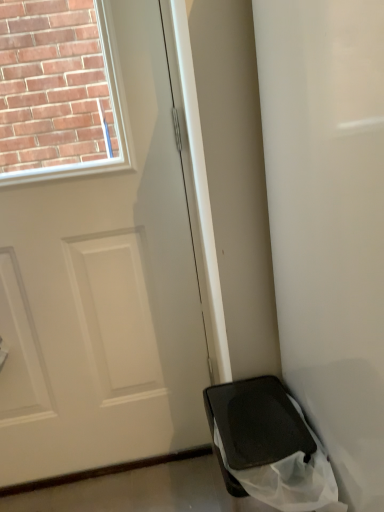
The height and width of the screenshot is (512, 384). Describe the element at coordinates (329, 221) in the screenshot. I see `black matte bag at lower right` at that location.

Where is `white matte door at center`? white matte door at center is located at coordinates (104, 294).

The height and width of the screenshot is (512, 384). What are the coordinates of `black matte bag at lower right` in the screenshot? It's located at (329, 221).

Is black matte bag at lower right positioned far away from white matte door at center?

black matte bag at lower right is near white matte door at center, not far away.

Which of these two, black matte bag at lower right or white matte door at center, stands shorter?

black matte bag at lower right is shorter.

From a real-world perspective, does black matte bag at lower right sit lower than white matte door at center?

Yes, from a real-world perspective, black matte bag at lower right is under white matte door at center.

Which point is more distant from viewer, [337,303] or [0,452]?

The point [0,452] is more distant.

Is black matte trash can at lower right completely or partially outside of black matte bag at lower right?

Yes, black matte trash can at lower right is not within black matte bag at lower right.

Considering the sizes of objects black matte trash can at lower right and black matte bag at lower right in the image provided, who is shorter, black matte trash can at lower right or black matte bag at lower right?

With less height is black matte trash can at lower right.

Which is behind, black matte trash can at lower right or black matte bag at lower right?

black matte trash can at lower right.

Considering the relative sizes of black matte bag at lower right and black matte trash can at lower right in the image provided, is black matte bag at lower right bigger than black matte trash can at lower right?

Correct, black matte bag at lower right is larger in size than black matte trash can at lower right.

Considering the points (301, 115) and (233, 492), which point is behind, point (301, 115) or point (233, 492)?

The point (233, 492) is farther from the camera.

From a real-world perspective, is black matte bag at lower right physically located above or below black matte trash can at lower right?

In terms of real-world spatial position, black matte bag at lower right is above black matte trash can at lower right.

You are a GUI agent. You are given a task and a screenshot of the screen. Output one action in this format:
    pyautogui.click(x=<x>, y=<y>)
    Task: Click on the screen door above the black matte trash can at lower right (from the image's perspective)
    
    Given the screenshot: What is the action you would take?
    pyautogui.click(x=329, y=221)

Considering the positions of point (115, 364) and point (311, 441), is point (115, 364) closer or farther from the camera than point (311, 441)?

Point (115, 364) appears to be farther away from the viewer than point (311, 441).

Is white matte door at center inside the boundaries of black matte trash can at lower right, or outside?

The correct answer is: outside.

Is white matte door at center wider or thinner than black matte trash can at lower right?

Considering their sizes, white matte door at center looks slimmer than black matte trash can at lower right.

Does point (15, 321) appear closer or farther from the camera than point (315, 306)?

Point (15, 321) appears to be farther away from the viewer than point (315, 306).

What's the angular difference between white matte door at center and black matte bag at lower right's facing directions?

0.00226 degrees separate the facing orientations of white matte door at center and black matte bag at lower right.

Consider the image. From a real-world perspective, is white matte door at center located higher than black matte bag at lower right?

Yes, from a real-world perspective, white matte door at center is over black matte bag at lower right

Is white matte door at center with black matte bag at lower right?

white matte door at center is not next to black matte bag at lower right, and they're not touching.

From the image's perspective, is black matte trash can at lower right located beneath white matte door at center?

Correct, black matte trash can at lower right appears lower than white matte door at center in the image.

I want to click on door behind the black matte trash can at lower right, so click(104, 294).

From a real-world perspective, is black matte trash can at lower right on top of white matte door at center?

No, from a real-world perspective, black matte trash can at lower right is not over white matte door at center

Which of these two, black matte trash can at lower right or white matte door at center, is bigger?

white matte door at center is bigger.

Where is `screen door on the right side of white matte door at center`? screen door on the right side of white matte door at center is located at coordinates (329, 221).

Where is `screen door located above the black matte trash can at lower right (from a real-world perspective)`? The image size is (384, 512). screen door located above the black matte trash can at lower right (from a real-world perspective) is located at coordinates (329, 221).

Based on their spatial positions, is black matte trash can at lower right or white matte door at center closer to black matte bag at lower right?

black matte trash can at lower right lies closer to black matte bag at lower right than the other object.

From the image, which object appears to be nearer to black matte trash can at lower right, black matte bag at lower right or white matte door at center?

black matte bag at lower right is positioned closer to the anchor black matte trash can at lower right.

From the image, which object appears to be nearer to black matte trash can at lower right, white matte door at center or black matte bag at lower right?

black matte bag at lower right.

Estimate the real-world distances between objects in this image. Which object is closer to white matte door at center, black matte trash can at lower right or black matte bag at lower right?

→ Based on the image, black matte trash can at lower right appears to be nearer to white matte door at center.

Based on their spatial positions, is black matte bag at lower right or black matte trash can at lower right further from white matte door at center?

Based on the image, black matte bag at lower right appears to be further to white matte door at center.

Based on their spatial positions, is white matte door at center or black matte trash can at lower right closer to black matte bag at lower right?

black matte trash can at lower right is positioned closer to the anchor black matte bag at lower right.

Locate an element on the screen. This screenshot has width=384, height=512. furniture between white matte door at center and black matte bag at lower right in the horizontal direction is located at coordinates (256, 422).